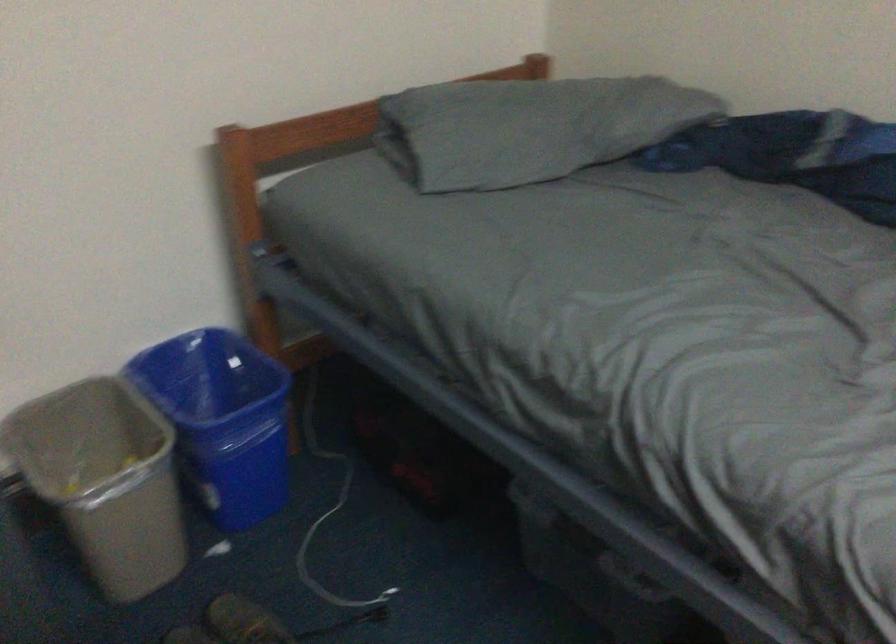
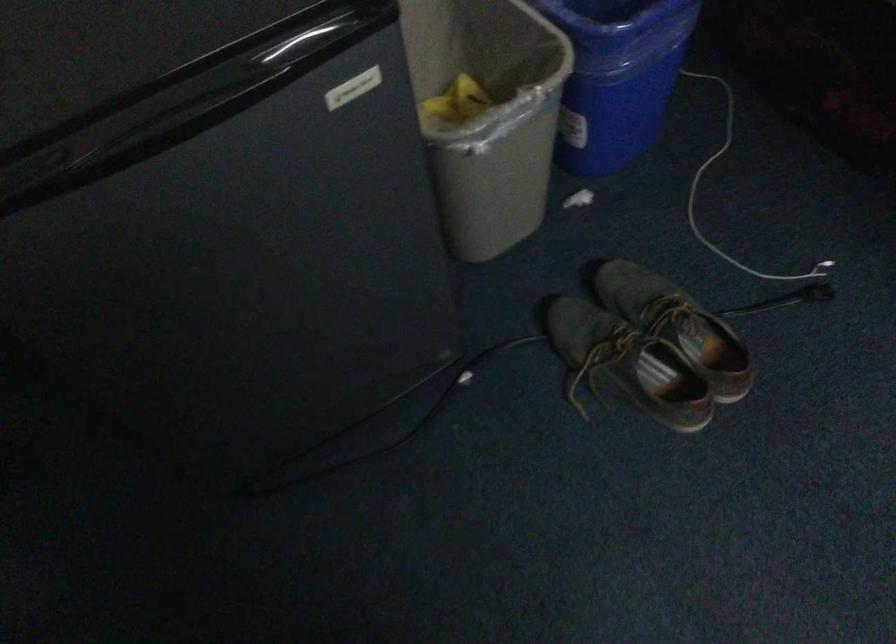
Locate, in the second image, the point that corresponds to point (338, 542) in the first image.

(734, 196)